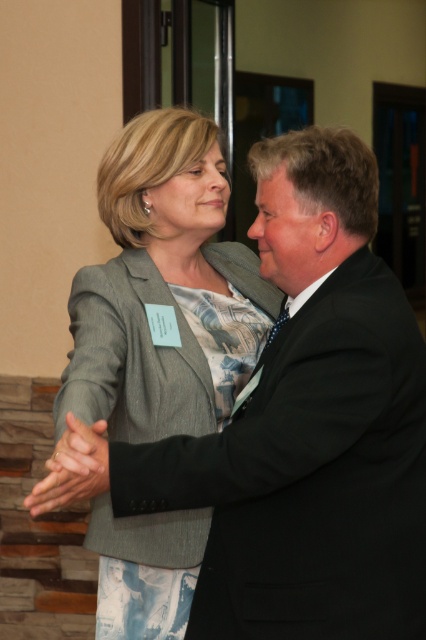
Does point (344, 518) come closer to viewer compared to point (111, 536)?

Yes, it is.

Between black satin business suit at center and gray textured blazer at center, which one has less height?

With less height is black satin business suit at center.

Between point (388, 417) and point (183, 156), which one is positioned behind?

Point (183, 156)

Locate an element on the screen. black satin business suit at center is located at coordinates (307, 476).